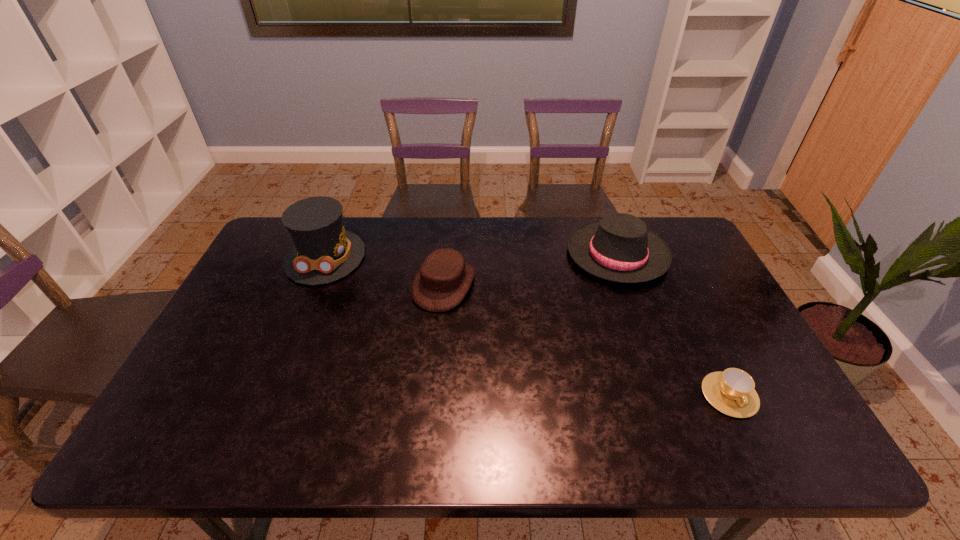
I want to click on vacant region located on the left of the shortest hat, so click(348, 285).

Where is `object located at the left edge`? This screenshot has height=540, width=960. object located at the left edge is located at coordinates (323, 252).

This screenshot has height=540, width=960. What are the coordinates of `dress hat present at the right edge` in the screenshot? It's located at (619, 248).

In order to click on cup positioned at the right edge in this screenshot , I will do `click(732, 392)`.

Image resolution: width=960 pixels, height=540 pixels. Identify the location of object located at the far left corner. click(323, 252).

Find the location of a particular element. The image size is (960, 540). object located at the far right corner is located at coordinates (619, 248).

This screenshot has width=960, height=540. In order to click on vacant area at the far edge of the desktop in this screenshot , I will do `click(460, 221)`.

Where is `vacant space at the near edge of the desktop`? vacant space at the near edge of the desktop is located at coordinates (543, 446).

At what (x,y) coordinates should I click in order to perform the action: click on free location at the left edge of the desktop. Please return your answer as a coordinate pair (x, y). Looking at the image, I should click on (276, 268).

In the image, there is a desktop. What are the coordinates of `vacant space at the right edge` in the screenshot? It's located at (709, 277).